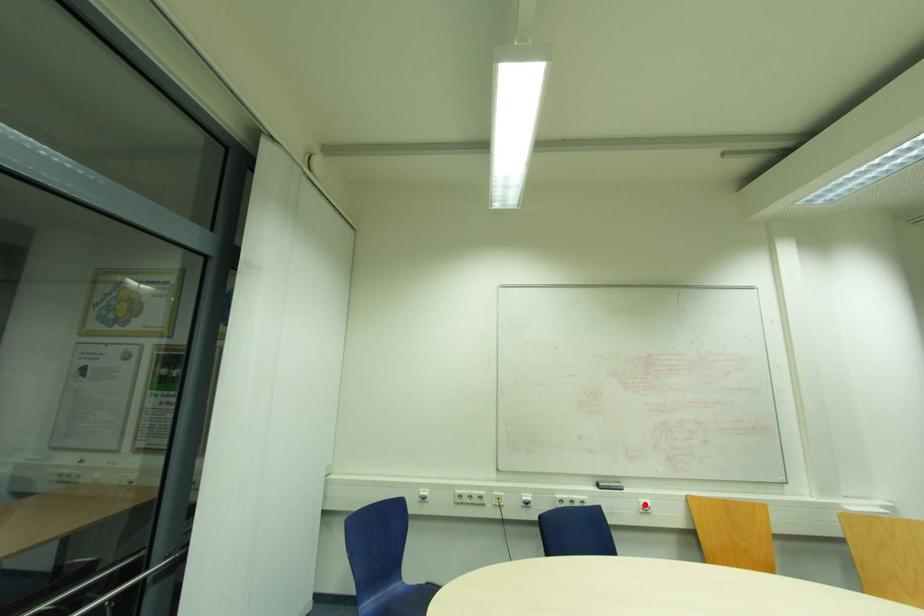
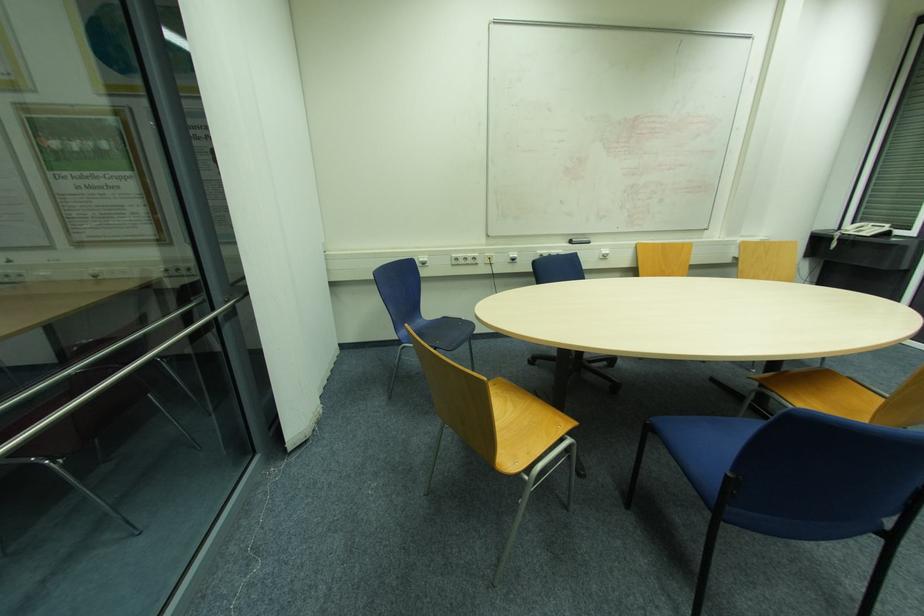
Question: I am providing you with two images of the same scene from different viewpoints. A red point is shown in image1. For the corresponding object point in image2, is it positioned nearer or farther from the camera?

Choices:
 (A) Nearer
 (B) Farther

Answer: (A)